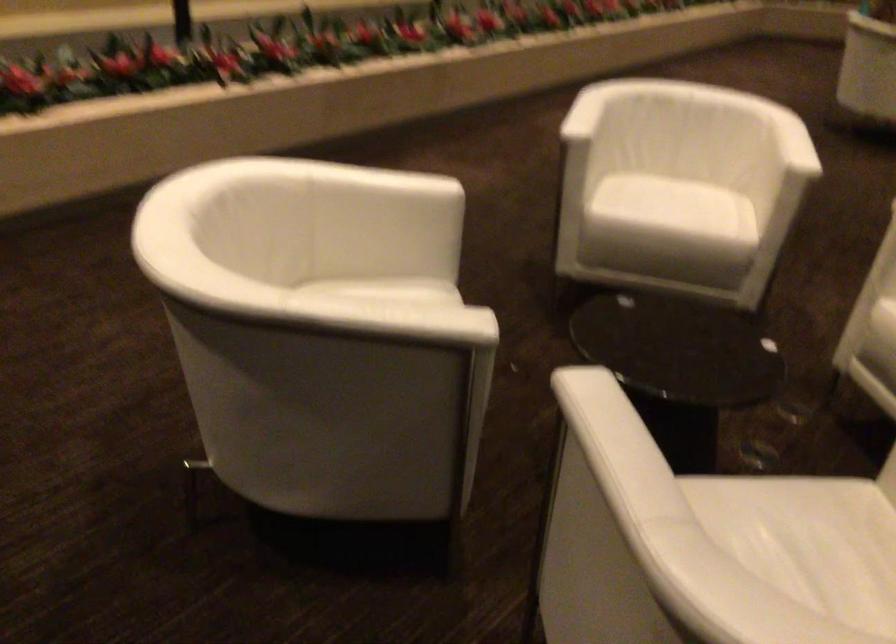
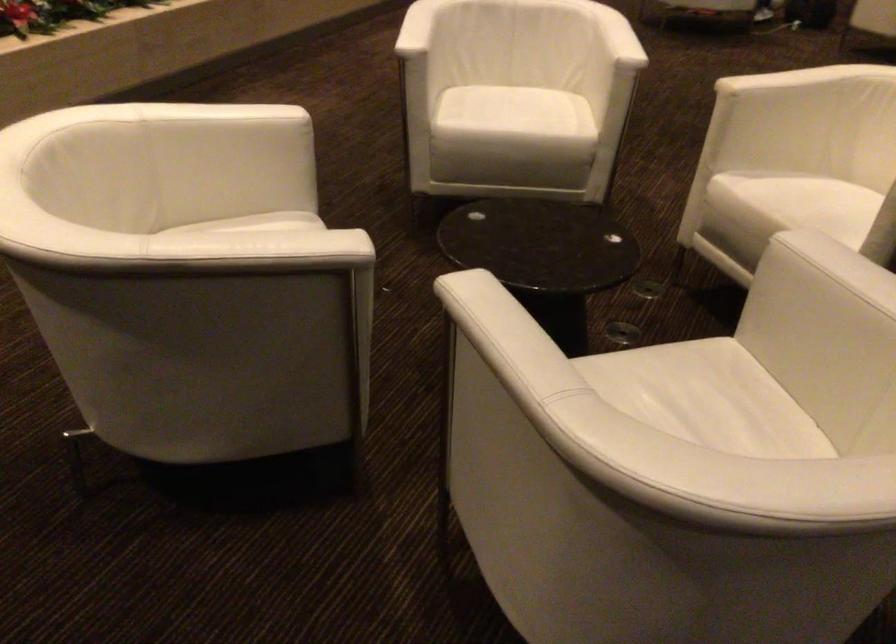
In the second image, find the point that corresponds to [601,428] in the first image.

(494, 322)